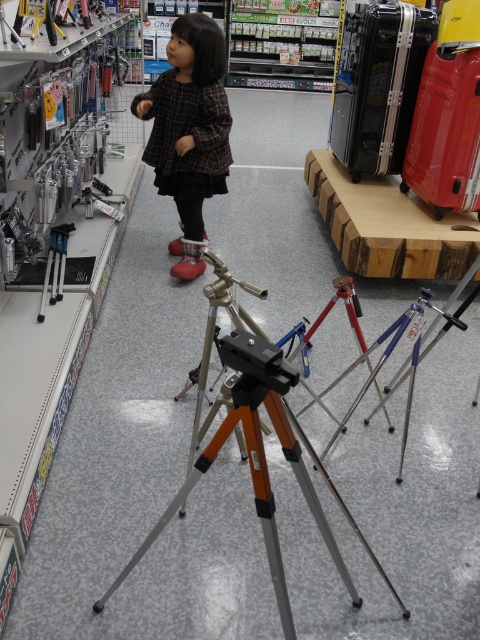
Question: Considering the relative positions of silver metallic tripod at center and plaid fabric dress at center in the image provided, where is silver metallic tripod at center located with respect to plaid fabric dress at center?

Choices:
 (A) below
 (B) above

Answer: (A)

Question: Does silver metallic tripod at center have a smaller size compared to plaid fabric dress at center?

Choices:
 (A) no
 (B) yes

Answer: (A)

Question: Can you confirm if silver metallic tripod at center is positioned above plaid fabric dress at center?

Choices:
 (A) yes
 (B) no

Answer: (B)

Question: Which object is closer to the camera taking this photo?

Choices:
 (A) plaid fabric dress at center
 (B) silver metallic tripod at center

Answer: (B)